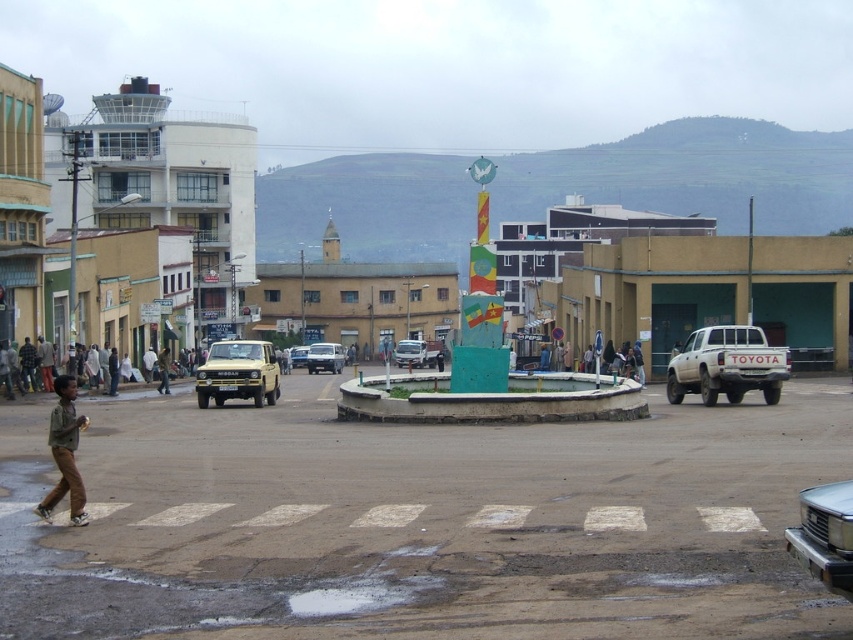
Does white matte truck at right appear over matte silver van at center?

Yes.

From the picture: Measure the distance between point (709, 397) and camera.

Point (709, 397) is 31.77 meters away from camera.

Between point (720, 371) and point (421, 346), which one is positioned in front?

Point (720, 371) is in front.

Locate an element on the screen. The height and width of the screenshot is (640, 853). white matte truck at right is located at coordinates (726, 365).

Is white matte truck at right wider than brown cotton shirt at lower left?

Yes.

Between point (740, 385) and point (53, 385), which one is positioned behind?

Positioned behind is point (53, 385).

I want to click on white matte truck at right, so click(726, 365).

Does point (204, 406) lie behind point (338, 368)?

No.

Is yellow matte truck at center-left to the right of metallic silver car at center from the viewer's perspective?

Indeed, yellow matte truck at center-left is positioned on the right side of metallic silver car at center.

Find the location of `yellow matte truck at center-left`. yellow matte truck at center-left is located at coordinates (238, 372).